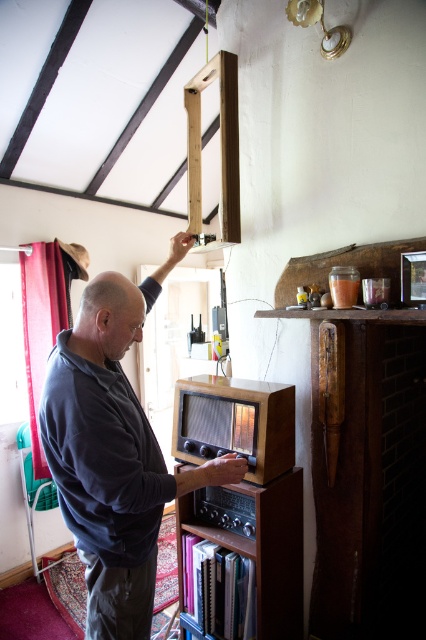
From the picture: You are standing in the room and want to pick up the dark blue sweater at lower left and the wooden bookshelf at center. Which object is easier to reach without moving your position?

The dark blue sweater at lower left is closer to the viewer than the wooden bookshelf at center, so it is easier to reach without moving your position.

You are organizing a charity event and need to decide whether to place a large donation box on the floor next to the dark blue sweater at lower left or on the wooden bookshelf at center. Based on their sizes, which location would be more appropriate?

The dark blue sweater at lower left has a larger size compared to the wooden bookshelf at center, so placing the large donation box next to the dark blue sweater at lower left would be more appropriate as there is more space available there.

Looking at this image, you are organizing a display in the room and need to place a 1.2 meter tall sculpture. You see the dark blue sweater at lower left and the wooden bookshelf at center. Which object can the sculpture be placed on without exceeding its height?

The sculpture cannot be placed on either the dark blue sweater at lower left or the wooden bookshelf at center because the dark blue sweater at lower left is taller than the wooden bookshelf at center, but neither has a height sufficient to support a 1.2 meter tall sculpture.